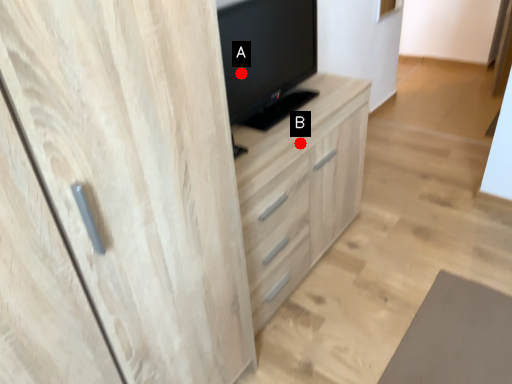
Question: Two points are circled on the image, labeled by A and B beside each circle. Which point is farther from the camera taking this photo?

Choices:
 (A) A is further
 (B) B is further

Answer: (B)